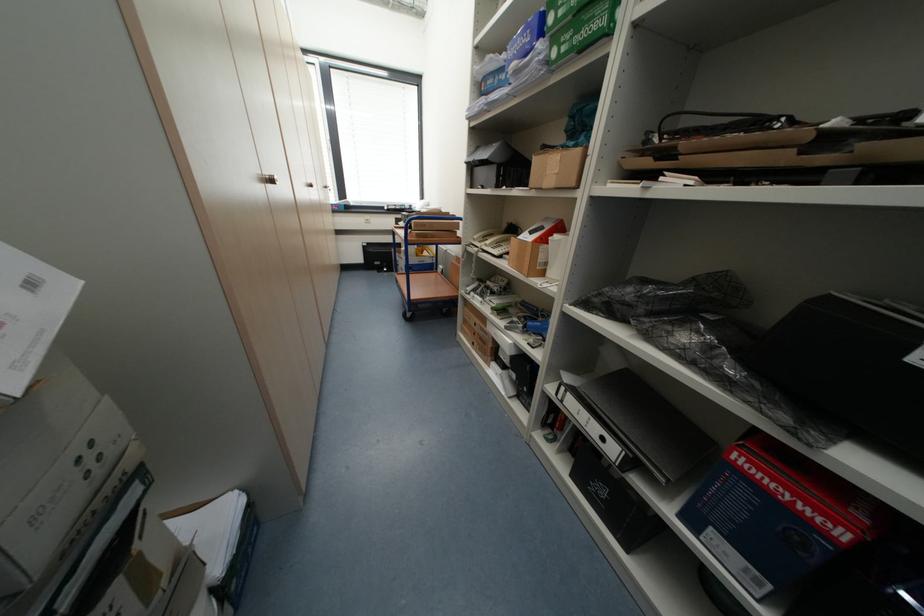
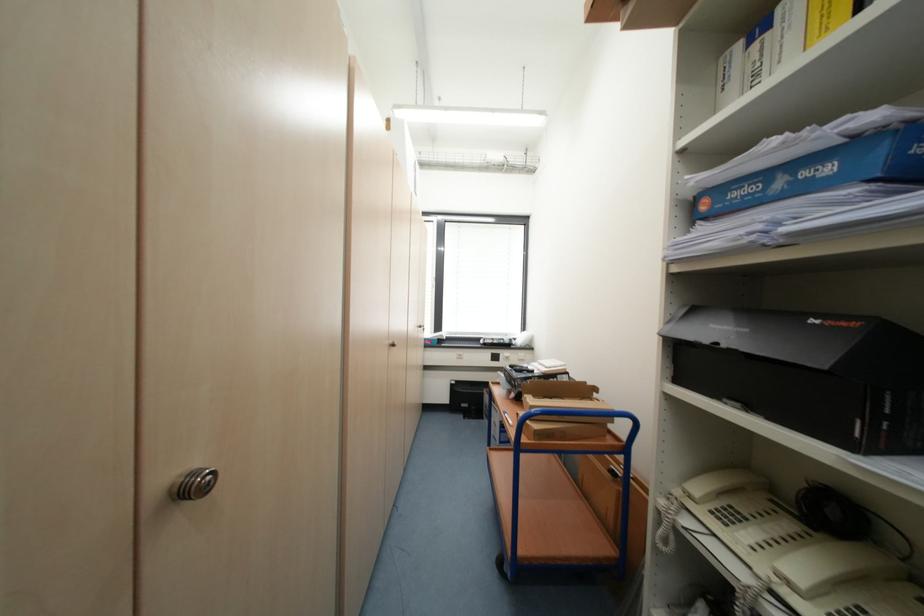
First-person continuous shooting, in which direction is the camera rotating?

The camera's rotation is toward left-up.